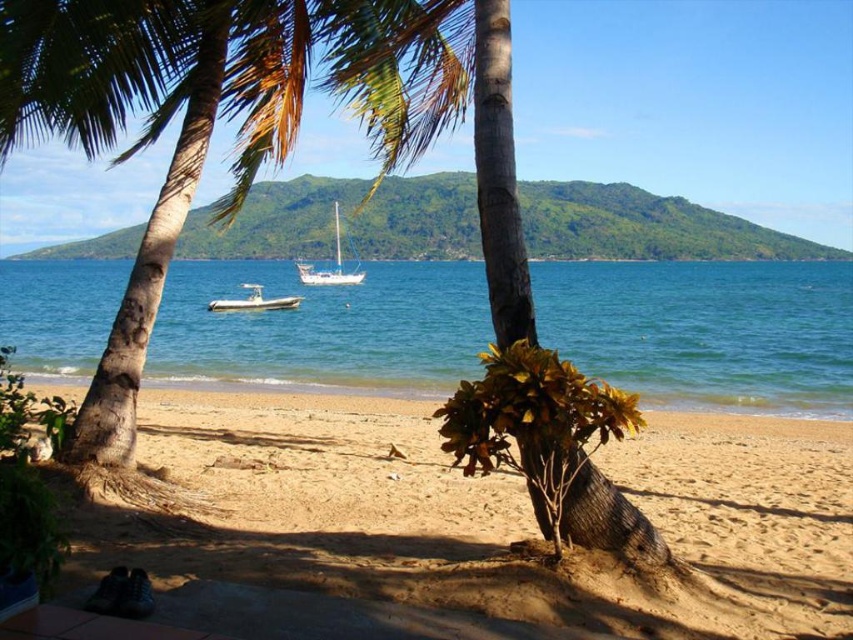
Question: Is sandy beach at lower center to the right of green leafy palm tree at center from the viewer's perspective?

Choices:
 (A) yes
 (B) no

Answer: (A)

Question: Is white matte boat at center smaller than white glossy sailboat at center?

Choices:
 (A) yes
 (B) no

Answer: (A)

Question: Which object appears closest to the camera in this image?

Choices:
 (A) white glossy sailboat at center
 (B) clear blue water at center
 (C) sandy beach at lower center
 (D) green leafy palm tree at center

Answer: (C)

Question: Observing the image, what is the correct spatial positioning of clear blue water at center in reference to white glossy sailboat at center?

Choices:
 (A) below
 (B) above

Answer: (A)

Question: Among these points, which one is farthest from the camera?

Choices:
 (A) (149, 120)
 (B) (363, 275)

Answer: (B)

Question: Which object is positioned farthest from the sandy beach at lower center?

Choices:
 (A) white matte boat at center
 (B) green leafy palm tree at center
 (C) white glossy sailboat at center

Answer: (C)